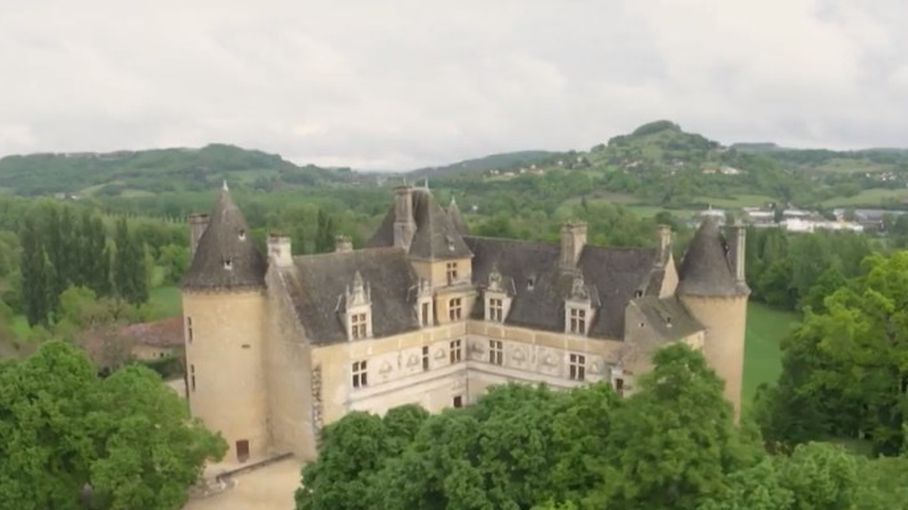
Image resolution: width=908 pixels, height=510 pixels. What are the coordinates of `chimney` in the screenshot? It's located at (398, 206), (575, 249), (281, 247), (664, 234).